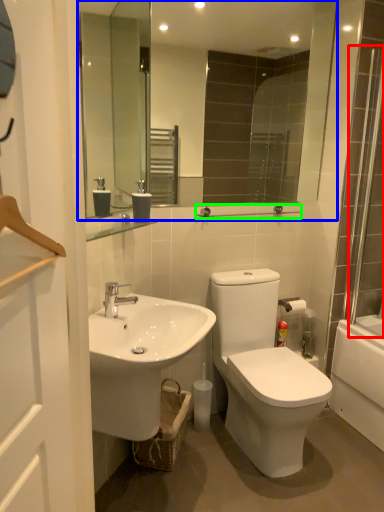
Question: Which object is positioned closest to shower door (highlighted by a red box)? Select from mirror (highlighted by a blue box) and balustrade (highlighted by a green box).

Choices:
 (A) mirror
 (B) balustrade

Answer: (B)